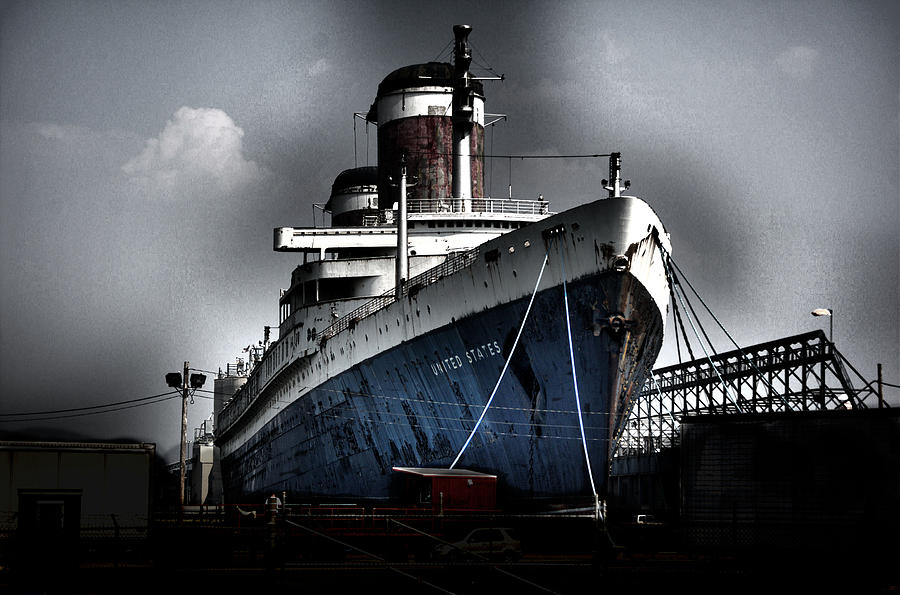
Find the location of a particular element. lamp is located at coordinates (195, 378), (176, 375).